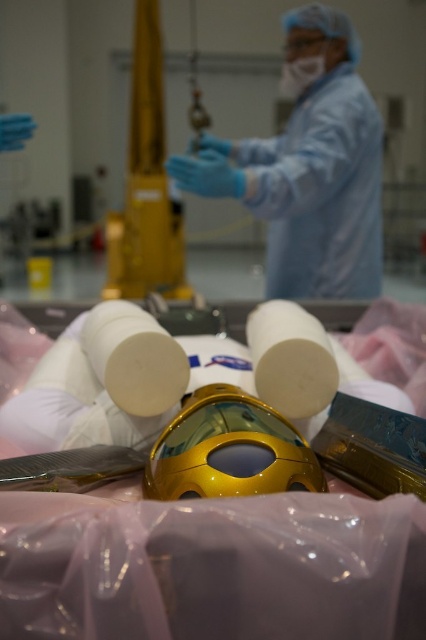
What do you see at coordinates (229, 451) in the screenshot? I see `metallic gold helmet at center` at bounding box center [229, 451].

Is metallic gold helmet at center positioned at the back of white matte toilet paper at center?

No, metallic gold helmet at center is closer to the viewer.

Between point (215, 474) and point (253, 356), which one is positioned in front?

Point (215, 474) is more forward.

Where is `metallic gold helmet at center`? metallic gold helmet at center is located at coordinates (229, 451).

Is metallic gold helmet at center taller than matte white mask at upper center?

In fact, metallic gold helmet at center may be shorter than matte white mask at upper center.

The image size is (426, 640). Describe the element at coordinates (229, 451) in the screenshot. I see `metallic gold helmet at center` at that location.

Does point (229, 406) come in front of point (299, 72)?

That is True.

The height and width of the screenshot is (640, 426). I want to click on metallic gold helmet at center, so click(229, 451).

In the scene shown: Can you confirm if blue latex gloves at center is positioned to the left of matte white mask at upper center?

Indeed, blue latex gloves at center is positioned on the left side of matte white mask at upper center.

Looking at this image, can you confirm if blue latex gloves at center is smaller than matte white mask at upper center?

Incorrect, blue latex gloves at center is not smaller in size than matte white mask at upper center.

Find the location of a particular element. The image size is (426, 640). blue latex gloves at center is located at coordinates (307, 168).